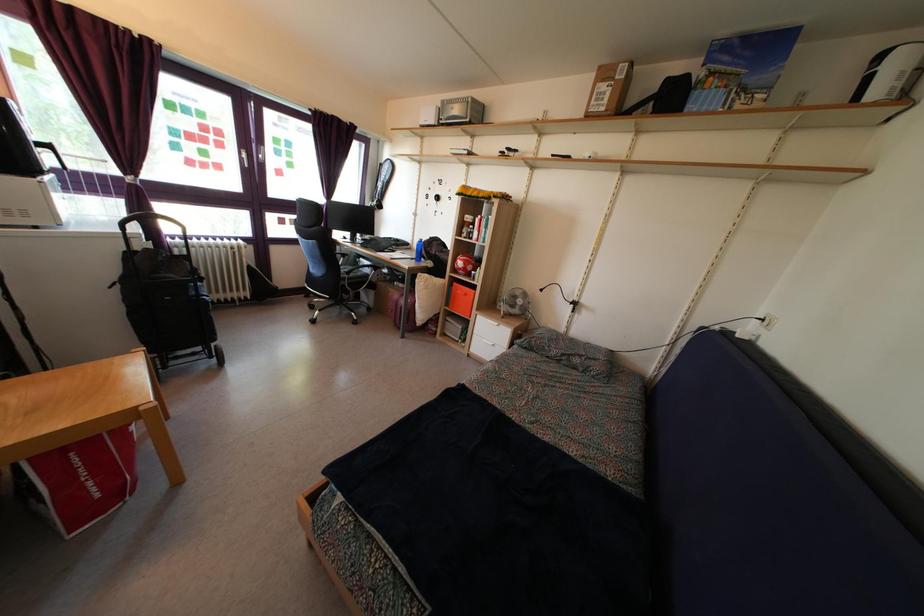
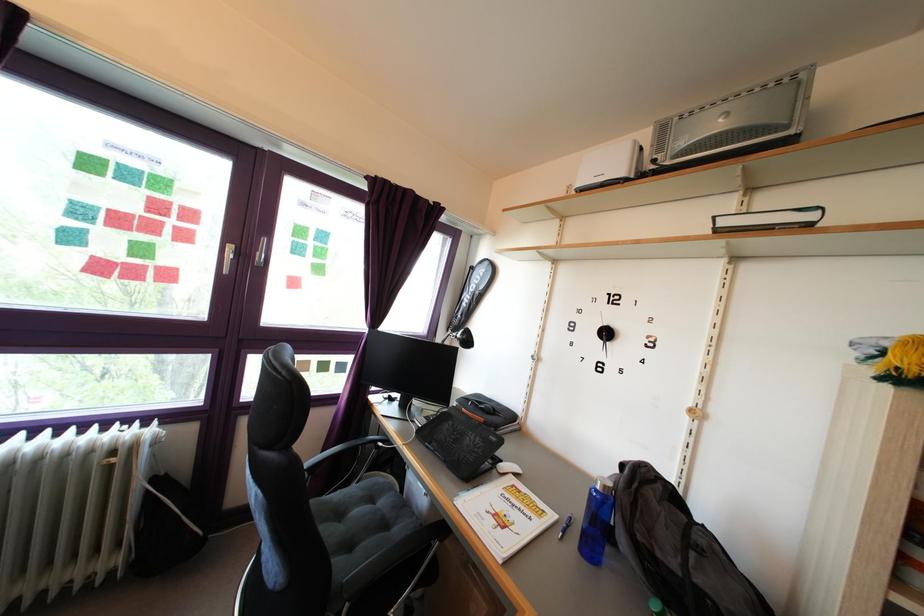
The point at [423,249] is marked in the first image. Where is the corresponding point in the second image?

(609, 496)